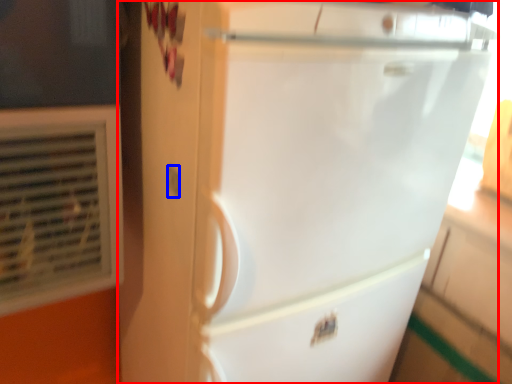
Question: Which point is closer to the camera, refrigerator (highlighted by a red box) or electric outlet (highlighted by a blue box)?

Choices:
 (A) refrigerator
 (B) electric outlet

Answer: (A)